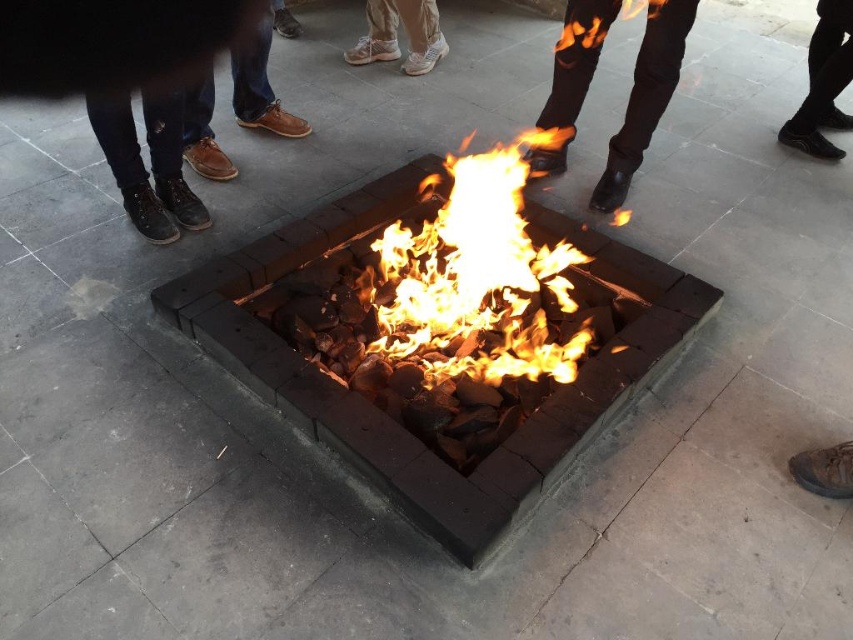
What do you see at coordinates (396, 420) in the screenshot?
I see `charcoal brick fire pit at center` at bounding box center [396, 420].

Can you confirm if charcoal brick fire pit at center is positioned to the left of brown leather shoes at left?

No, charcoal brick fire pit at center is not to the left of brown leather shoes at left.

Which is behind, point (407, 173) or point (206, 120)?

Point (206, 120)

Locate an element on the screen. The image size is (853, 640). charcoal brick fire pit at center is located at coordinates pos(396,420).

Can you confirm if flaming wood at center is positioned below black leather shoes at right?

Indeed, flaming wood at center is positioned under black leather shoes at right.

Is flaming wood at center thinner than black leather shoes at right?

Incorrect, flaming wood at center's width is not less than black leather shoes at right's.

The height and width of the screenshot is (640, 853). Describe the element at coordinates (474, 275) in the screenshot. I see `flaming wood at center` at that location.

Identify the location of flaming wood at center. pyautogui.click(x=474, y=275).

Who is positioned more to the right, charcoal brick fire pit at center or leather boots at center?

leather boots at center

Image resolution: width=853 pixels, height=640 pixels. What do you see at coordinates (396, 420) in the screenshot?
I see `charcoal brick fire pit at center` at bounding box center [396, 420].

Who is more distant from viewer, (399, 189) or (575, 52)?

The point (575, 52) is more distant.

At what (x,y) coordinates should I click in order to perform the action: click on charcoal brick fire pit at center. Please return your answer as a coordinate pair (x, y). The image size is (853, 640). Looking at the image, I should click on (396, 420).